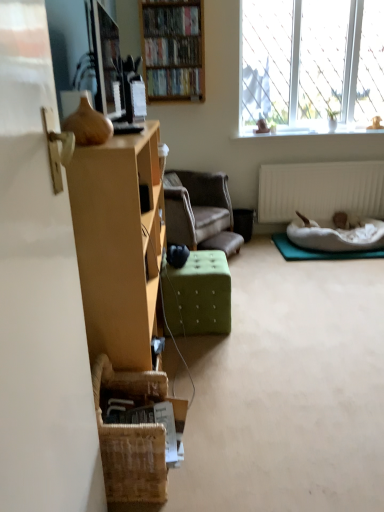
Question: Is the position of white fluffy cat at lower right more distant than that of white textured radiator at lower right?

Choices:
 (A) yes
 (B) no

Answer: (B)

Question: Considering the relative positions of white fluffy cat at lower right and white textured radiator at lower right in the image provided, is white fluffy cat at lower right to the left of white textured radiator at lower right from the viewer's perspective?

Choices:
 (A) no
 (B) yes

Answer: (A)

Question: From the image's perspective, is white fluffy cat at lower right above white textured radiator at lower right?

Choices:
 (A) yes
 (B) no

Answer: (B)

Question: Is white fluffy cat at lower right thinner than white textured radiator at lower right?

Choices:
 (A) no
 (B) yes

Answer: (A)

Question: From a real-world perspective, is white fluffy cat at lower right positioned under white textured radiator at lower right based on gravity?

Choices:
 (A) yes
 (B) no

Answer: (A)

Question: Considering the positions of velvet brown armchair at center and white soft pet bed at lower right in the image, is velvet brown armchair at center taller or shorter than white soft pet bed at lower right?

Choices:
 (A) tall
 (B) short

Answer: (A)

Question: Do you think velvet brown armchair at center is within white soft pet bed at lower right, or outside of it?

Choices:
 (A) inside
 (B) outside

Answer: (B)

Question: Looking at their shapes, would you say velvet brown armchair at center is wider or thinner than white soft pet bed at lower right?

Choices:
 (A) wide
 (B) thin

Answer: (A)

Question: From a real-world perspective, is velvet brown armchair at center above or below white soft pet bed at lower right?

Choices:
 (A) below
 (B) above

Answer: (B)

Question: From the image's perspective, is green fabric ottoman at center located above or below wooden bookshelf at upper center?

Choices:
 (A) above
 (B) below

Answer: (B)

Question: Is green fabric ottoman at center bigger or smaller than wooden bookshelf at upper center?

Choices:
 (A) big
 (B) small

Answer: (B)

Question: Does point coord(201,313) appear closer or farther from the camera than point coord(140,16)?

Choices:
 (A) closer
 (B) farther

Answer: (A)

Question: Is green fabric ottoman at center to the left or to the right of wooden bookshelf at upper center in the image?

Choices:
 (A) right
 (B) left

Answer: (A)

Question: Is wooden bookshelf at upper center, which is counted as the third book, starting from the bottom, in front of or behind white soft pet bed at lower right in the image?

Choices:
 (A) behind
 (B) front

Answer: (B)

Question: In terms of width, does wooden bookshelf at upper center, the first book viewed from the top, look wider or thinner when compared to white soft pet bed at lower right?

Choices:
 (A) wide
 (B) thin

Answer: (B)